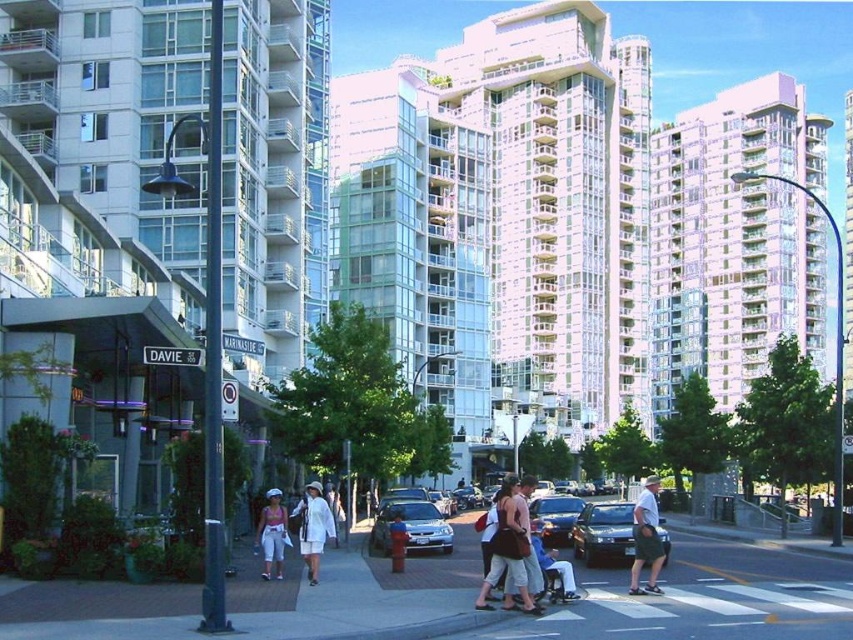
Question: Which is nearer to the concrete sidewalk at center?

Choices:
 (A) shiny black sedan at center
 (B) black rubber skateboard at lower center

Answer: (A)

Question: Does concrete sidewalk at center appear on the left side of black rubber skateboard at lower center?

Choices:
 (A) no
 (B) yes

Answer: (B)

Question: Is white cotton dress at center closer to camera compared to matte pink shorts at center?

Choices:
 (A) yes
 (B) no

Answer: (A)

Question: Can you confirm if green canvas skateboard at center is smaller than matte pink shorts at center?

Choices:
 (A) no
 (B) yes

Answer: (A)

Question: Estimate the real-world distances between objects in this image. Which object is closer to the black rubber skateboard at lower center?

Choices:
 (A) white cotton dress at center
 (B) shiny metallic sedan at center

Answer: (B)

Question: Considering the real-world distances, which object is farthest from the matte pink shorts at center?

Choices:
 (A) concrete sidewalk at center
 (B) green canvas skateboard at center
 (C) black rubber skateboard at lower center
 (D) silver metallic sedan at center

Answer: (B)